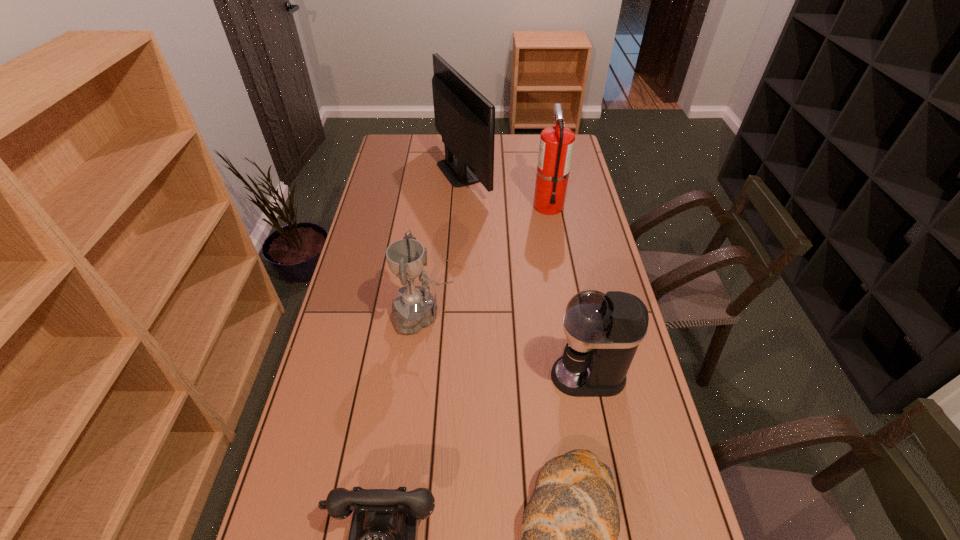
Where is `object that stands as the fourth closest to the computer monitor`? The height and width of the screenshot is (540, 960). object that stands as the fourth closest to the computer monitor is located at coordinates (570, 526).

This screenshot has width=960, height=540. Find the location of `the closest object relative to the shortest object`. the closest object relative to the shortest object is located at coordinates click(x=603, y=331).